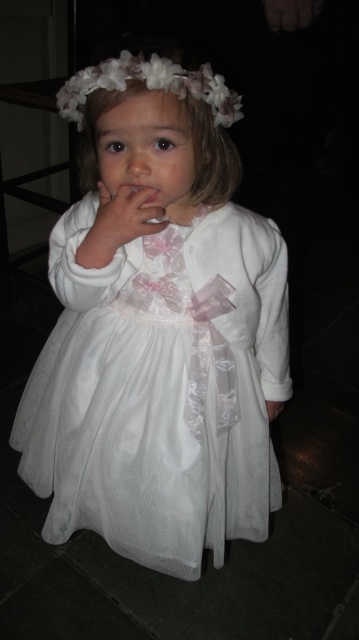
Does white silky hair at center appear over fluffy white flower at upper center?

Actually, white silky hair at center is below fluffy white flower at upper center.

Does point (106, 97) come farther from viewer compared to point (188, 81)?

Yes.

This screenshot has width=359, height=640. I want to click on white silky hair at center, so click(179, 104).

Can you confirm if white satin dress at center is positioned below matte white hand at center?

Indeed, white satin dress at center is positioned under matte white hand at center.

The image size is (359, 640). What do you see at coordinates (160, 388) in the screenshot?
I see `white satin dress at center` at bounding box center [160, 388].

This screenshot has height=640, width=359. What do you see at coordinates (160, 388) in the screenshot?
I see `white satin dress at center` at bounding box center [160, 388].

The image size is (359, 640). In order to click on white satin dress at center in this screenshot , I will do `click(160, 388)`.

Which of these two, white satin dress at center or white satin hand at lower center, stands shorter?

Standing shorter between the two is white satin hand at lower center.

Is white satin dress at center in front of white satin hand at lower center?

Yes, it is.

Between point (67, 358) and point (272, 416), which one is positioned in front?

Point (67, 358) is more forward.

Locate an element on the screen. The image size is (359, 640). white satin dress at center is located at coordinates (160, 388).